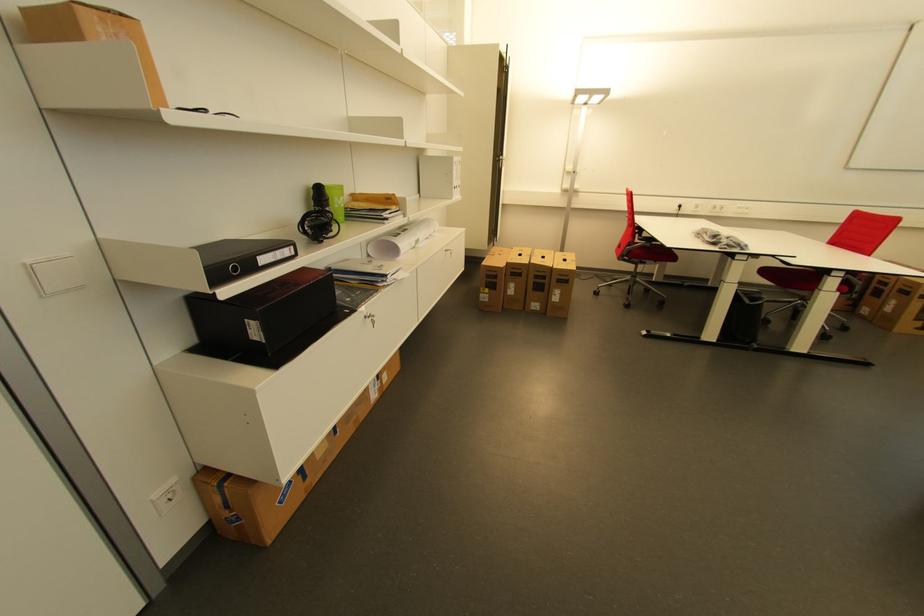
Image resolution: width=924 pixels, height=616 pixels. Identify the location of red chair sitting surface. (791, 277).